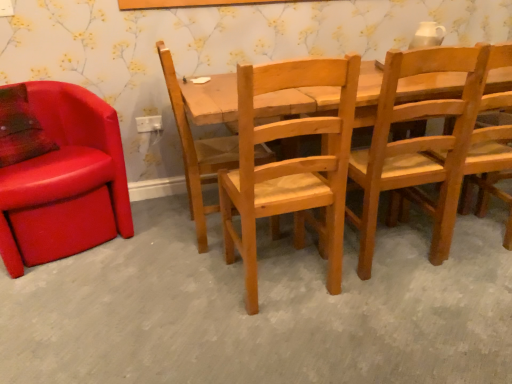
This screenshot has height=384, width=512. Identify the location of free spot below wooden chair at center, positioned as the fourth chair in left-to-right order (from a real-world perspective). (399, 249).